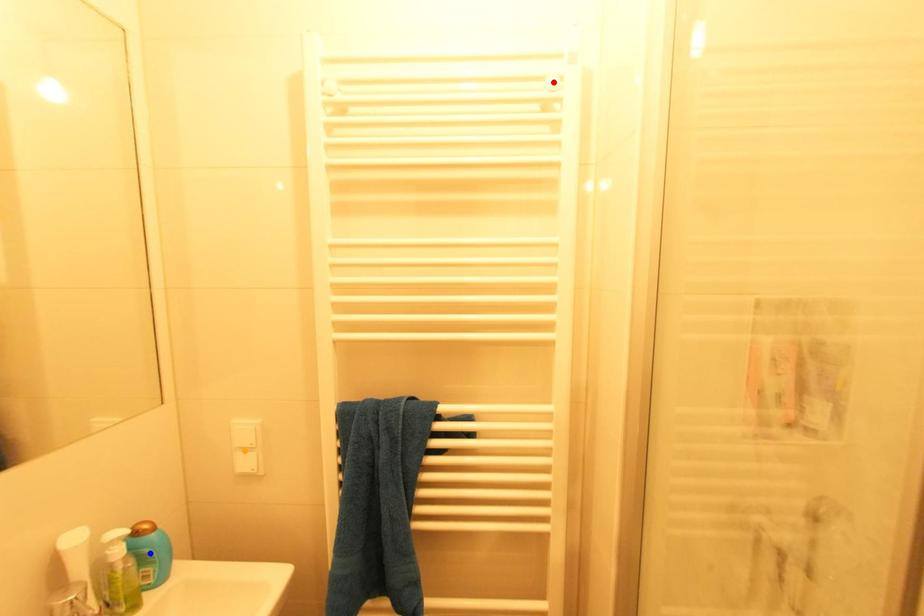
Order these from nearest to farthest:
- red point
- blue point
- orange point

blue point
red point
orange point